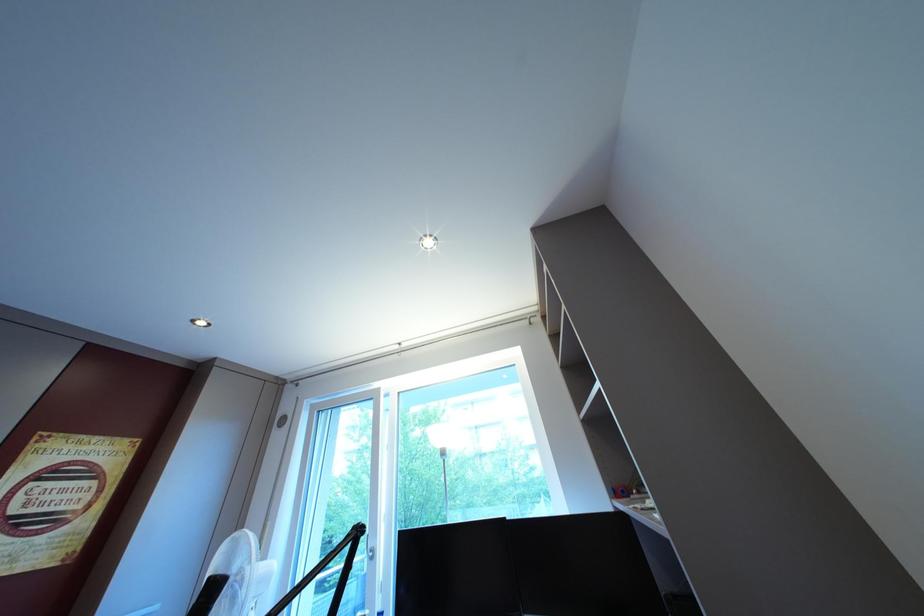
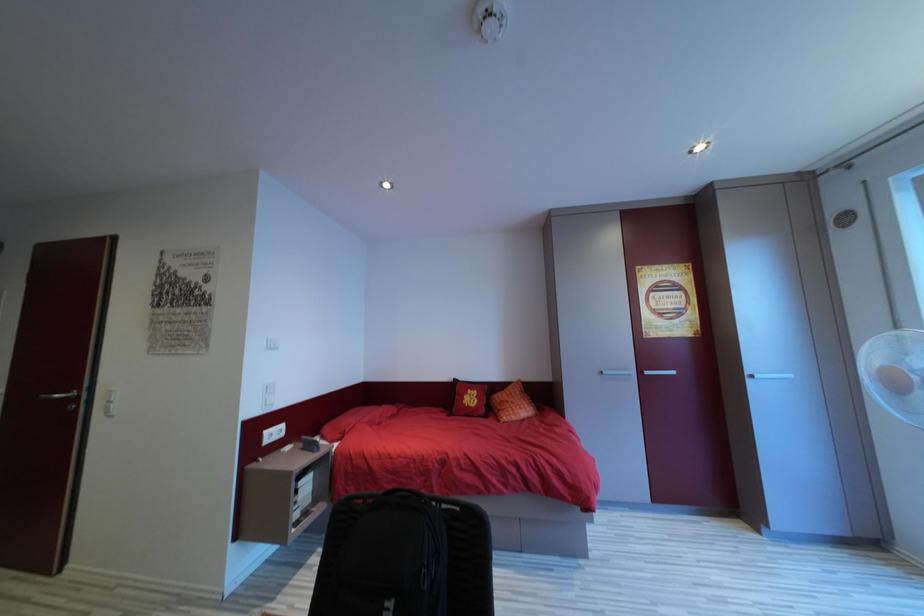
Question: How did the camera likely rotate?

Choices:
 (A) Left
 (B) Right
 (C) Up
 (D) Down

Answer: (A)